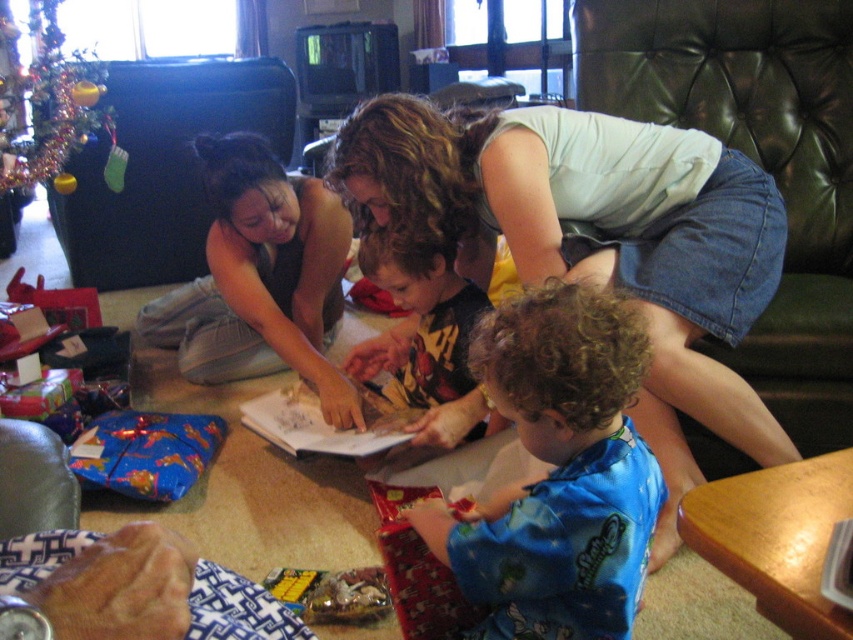
Can you confirm if denim skirt at center is wider than yellow printed shirt at center?

Yes.

Does denim skirt at center have a lesser height compared to yellow printed shirt at center?

→ In fact, denim skirt at center may be taller than yellow printed shirt at center.

Is point (424, 125) closer to viewer compared to point (409, 259)?

That is True.

Where is `denim skirt at center`? denim skirt at center is located at coordinates (596, 241).

Which is below, blue satin pajamas at lower center or yellow printed shirt at center?

blue satin pajamas at lower center is lower down.

Is point (531, 552) less distant than point (454, 410)?

Yes, point (531, 552) is closer to viewer.

Where is `blue satin pajamas at lower center`? blue satin pajamas at lower center is located at coordinates (558, 472).

Is matte black shirt at center shorter than yellow printed shirt at center?

No, matte black shirt at center is not shorter than yellow printed shirt at center.

Is matte black shirt at center thinner than yellow printed shirt at center?

Incorrect, matte black shirt at center's width is not less than yellow printed shirt at center's.

In the scene shown: Who is more forward, (332, 289) or (383, 339)?

Point (383, 339) is in front.

Find the location of a particular element. The image size is (853, 640). matte black shirt at center is located at coordinates (260, 278).